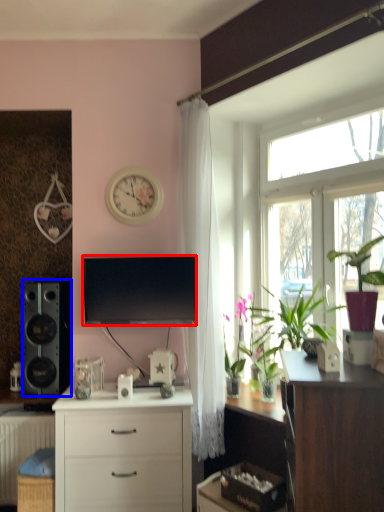
Question: Which object is further to the camera taking this photo, television (highlighted by a red box) or loudspeaker (highlighted by a blue box)?

Choices:
 (A) television
 (B) loudspeaker

Answer: (B)